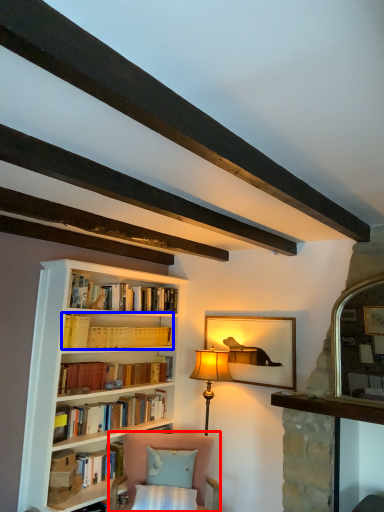
Question: Which object appears closest to the camera in this image, chair (highlighted by a red box) or book (highlighted by a blue box)?

Choices:
 (A) chair
 (B) book

Answer: (A)